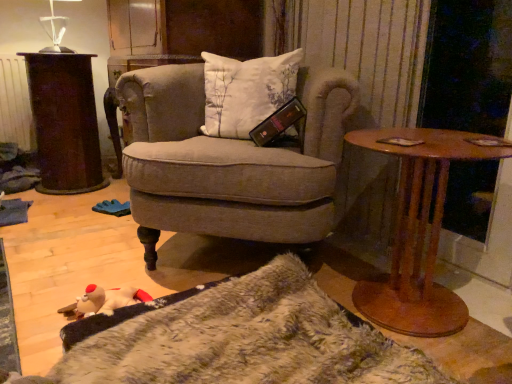
Question: From their relative heights in the image, would you say rusty metal trash can at left is taller or shorter than brown wooden table at right?

Choices:
 (A) tall
 (B) short

Answer: (A)

Question: From the image's perspective, relative to brown wooden table at right, is rusty metal trash can at left above or below?

Choices:
 (A) above
 (B) below

Answer: (A)

Question: Estimate the real-world distances between objects in this image. Which object is farther from the textured beige armchair at center?

Choices:
 (A) transparent glass table lamp at upper left
 (B) brown wooden table at right
 (C) rusty metal trash can at left

Answer: (A)

Question: Considering the real-world distances, which object is farthest from the textured beige armchair at center?

Choices:
 (A) brown wooden table at right
 (B) transparent glass table lamp at upper left
 (C) rusty metal trash can at left

Answer: (B)